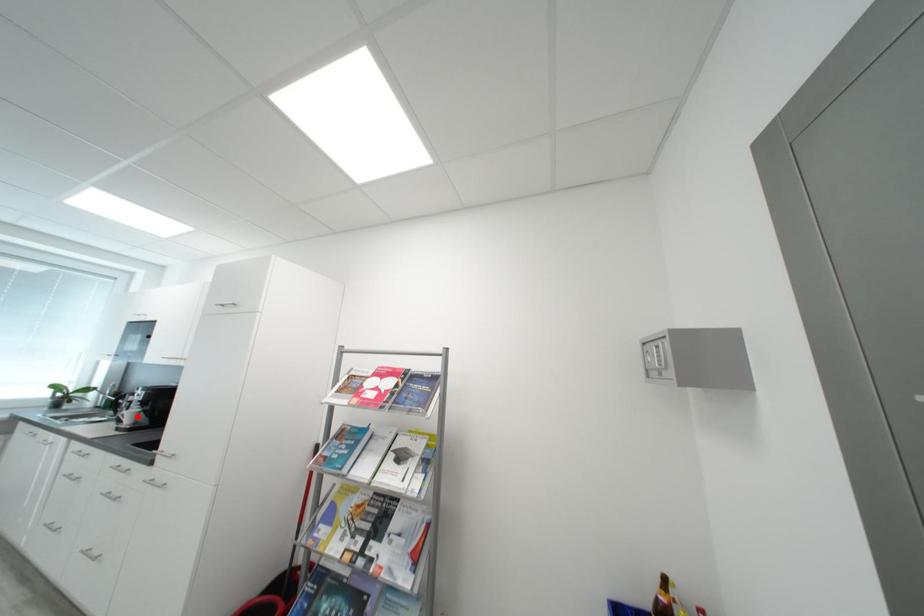
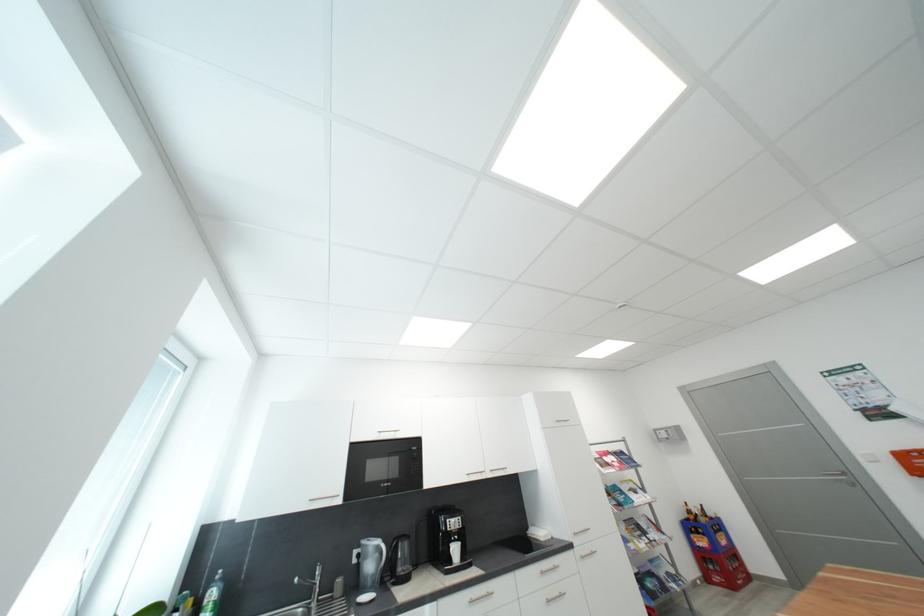
Find the pixel in the second image that matches the highlighted location in the first image.

(463, 552)